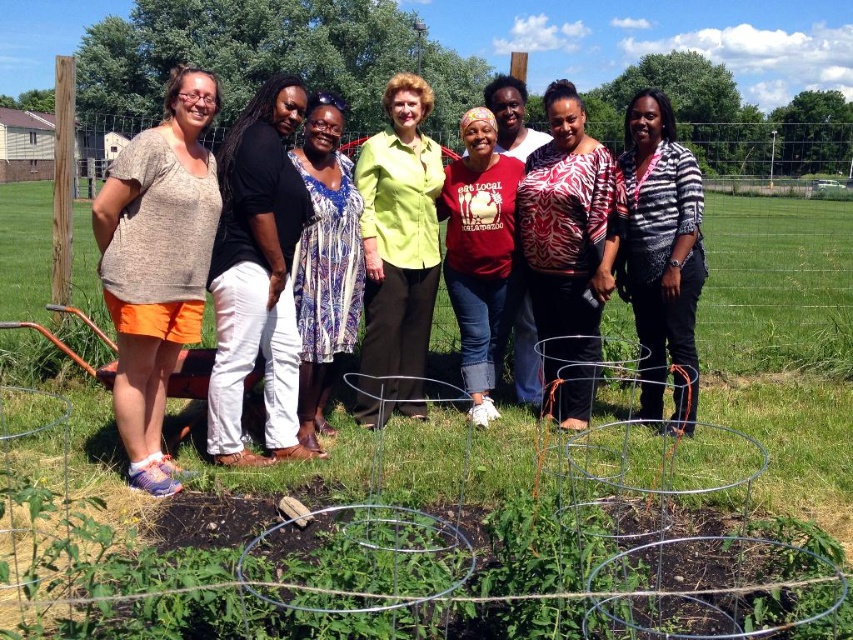
Question: Is wire mesh garden at center bigger than matte orange shorts at left?

Choices:
 (A) yes
 (B) no

Answer: (A)

Question: Which object appears closest to the camera in this image?

Choices:
 (A) matte orange shorts at left
 (B) printed fabric blouse at center
 (C) wire mesh garden at center
 (D) striped cotton shirt at center

Answer: (C)

Question: Is matte orange shorts at left wider than striped cotton shirt at center?

Choices:
 (A) no
 (B) yes

Answer: (A)

Question: Can you confirm if wire mesh garden at center is smaller than matte black shirt at center?

Choices:
 (A) yes
 (B) no

Answer: (B)

Question: Which object is closer to the camera taking this photo?

Choices:
 (A) blue printed dress at center
 (B) matte red shirt at center
 (C) wire mesh garden at center

Answer: (C)

Question: Among these objects, which one is farthest from the camera?

Choices:
 (A) green matte shirt at center
 (B) wire mesh garden at center

Answer: (A)